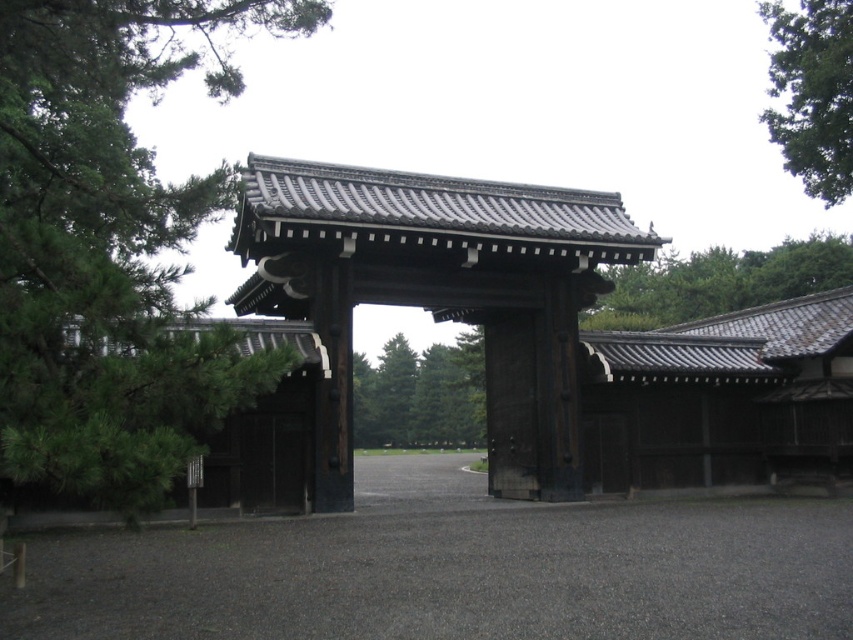
Question: Observing the image, what is the correct spatial positioning of green shingled roof at upper center in reference to green leafy tree at upper right?

Choices:
 (A) left
 (B) right

Answer: (A)

Question: Among these points, which one is nearest to the camera?

Choices:
 (A) (456, 280)
 (B) (753, 296)
 (C) (409, 387)

Answer: (A)

Question: Which point is closer to the camera?

Choices:
 (A) green leafy tree at center
 (B) green leafy tree at left

Answer: (B)

Question: Can you confirm if green shingled roof at upper center is positioned below green leafy tree at center?

Choices:
 (A) yes
 (B) no

Answer: (B)

Question: Is green shingled roof at upper center to the right of green leafy tree at upper right from the viewer's perspective?

Choices:
 (A) yes
 (B) no

Answer: (B)

Question: Which object is positioned farthest from the green leafy tree at upper right?

Choices:
 (A) green leafy tree at center
 (B) black wood gate at center
 (C) green shingled roof at upper center

Answer: (A)